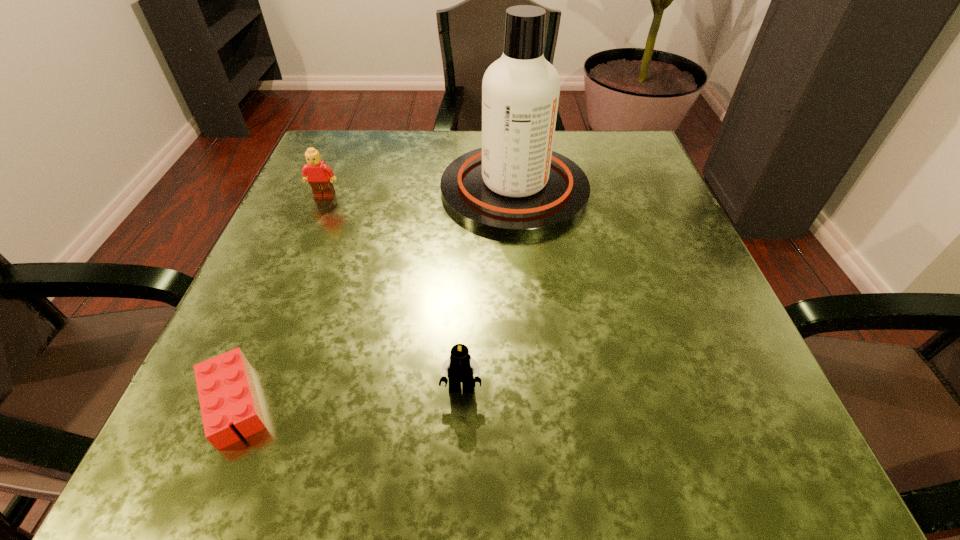
Where is `cleansing agent`? The height and width of the screenshot is (540, 960). cleansing agent is located at coordinates (515, 186).

I want to click on the farthest Lego, so click(x=320, y=176).

Find the location of a particular element. the tallest Lego is located at coordinates point(320,176).

I want to click on the rightmost Lego, so click(x=460, y=367).

This screenshot has height=540, width=960. Identify the location of the second shortest object. tap(460, 367).

Image resolution: width=960 pixels, height=540 pixels. I want to click on the shortest Lego, so click(227, 394).

Where is `free space located on the front of the cleansing agent`? free space located on the front of the cleansing agent is located at coordinates (527, 329).

Find the location of a particular element. vacant point located 0.390m on the face of the farthest Lego is located at coordinates (255, 365).

Identify the location of free point located on the front-facing side of the second shortest Lego. (460, 437).

I want to click on vacant point located on the right of the shortest Lego, so click(x=487, y=403).